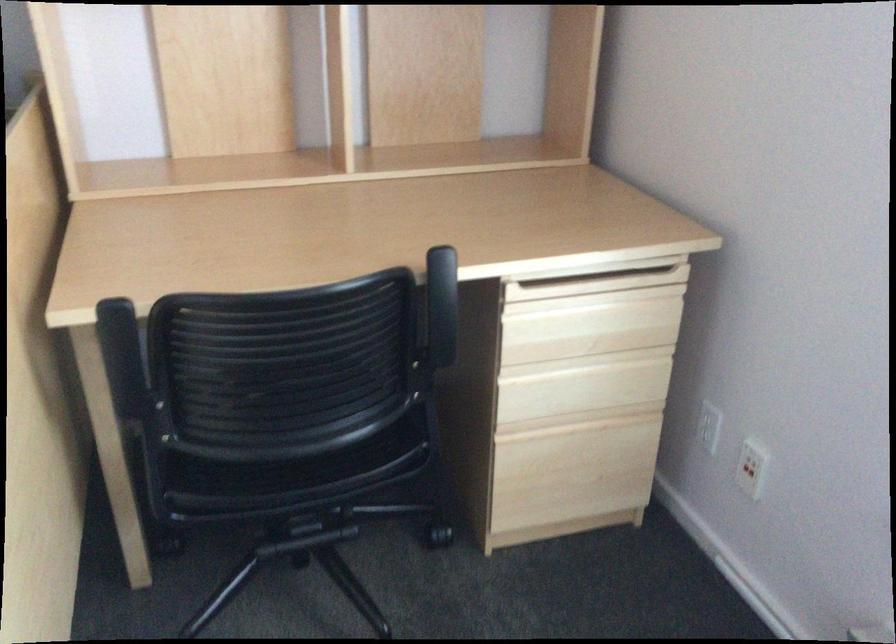
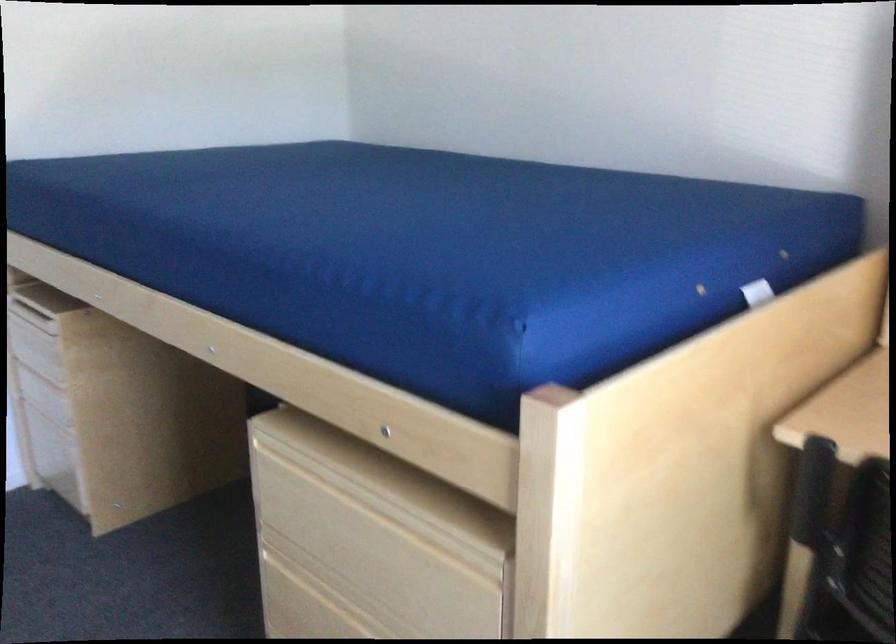
Question: The images are taken continuously from a first-person perspective. In which direction is your viewpoint rotating?

Choices:
 (A) Left
 (B) Right
 (C) Up
 (D) Down

Answer: (A)